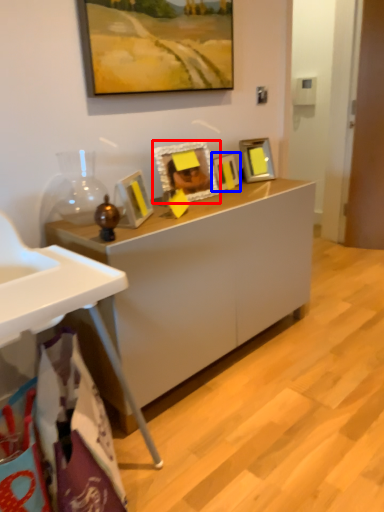
Question: Which point is further to the camera, picture frame (highlighted by a red box) or picture frame (highlighted by a blue box)?

Choices:
 (A) picture frame
 (B) picture frame

Answer: (B)